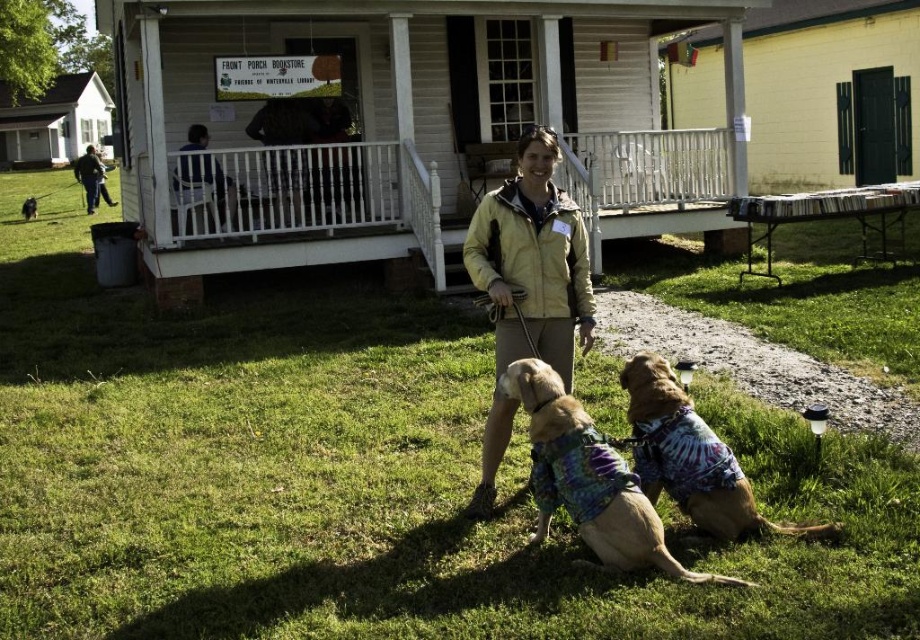
From the picture: You are a photographer trying to capture the scene of the woman and the two dogs. You want to ensure that both the green grass at lower center and the blue shirt at upper center are visible in your photo. Based on their heights, which object should you focus on first to ensure both are in frame?

The green grass at lower center has a greater height compared to the blue shirt at upper center, so you should focus on the green grass at lower center first to ensure both are in frame.

You are planning to take a nap in the sunny outdoor scene. Which object from the given list would be more comfortable to lie on for a nap and why? The objects are green grass at lower center and blue shirt at upper center.

The green grass at lower center would be more comfortable to lie on for a nap because it has a larger size compared to the blue shirt at upper center, making it a better surface for resting.